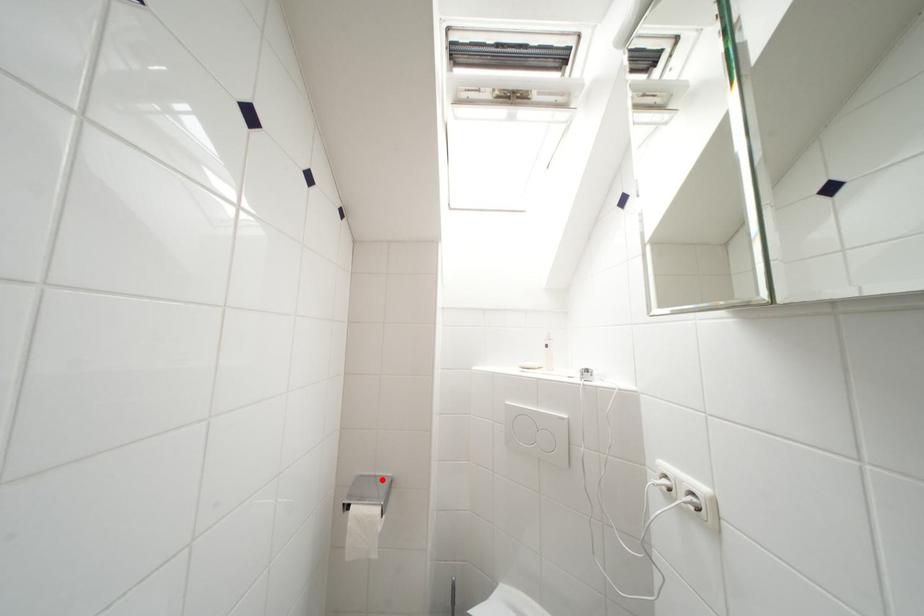
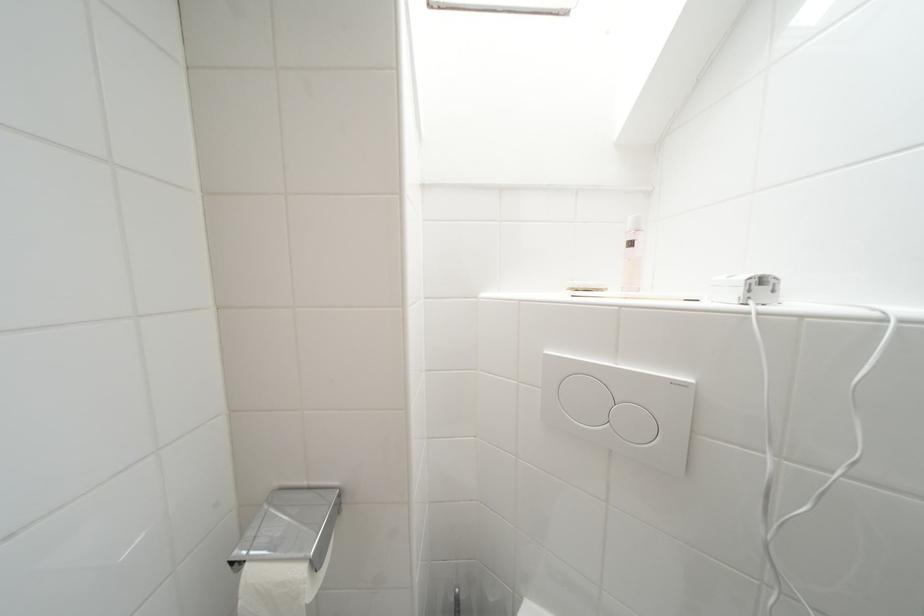
Where in the second image is the point corresponding to the highlighted location from the first image?

(315, 491)